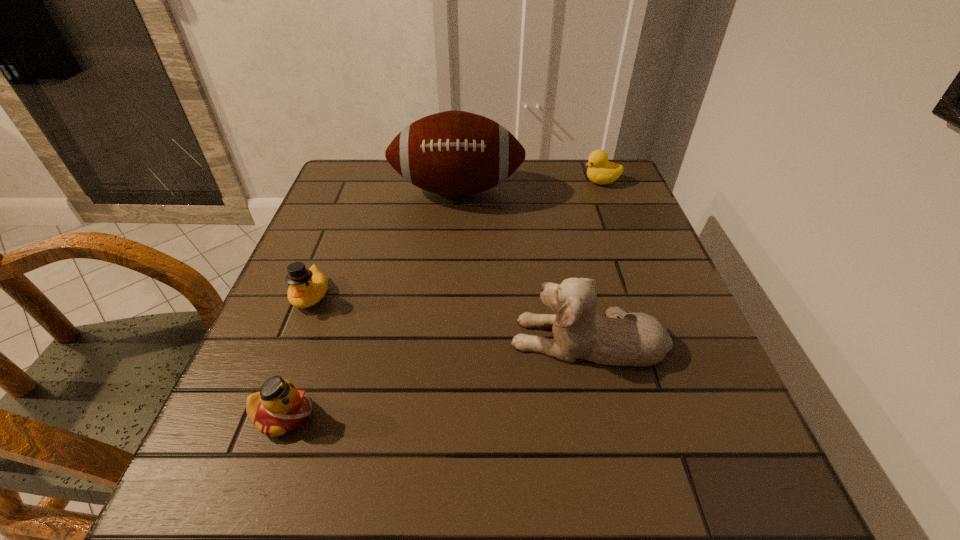
Image resolution: width=960 pixels, height=540 pixels. Find the location of `blank space located 0.390m on the front-facing side of the farthest duck`. blank space located 0.390m on the front-facing side of the farthest duck is located at coordinates (443, 181).

In order to click on free space located on the front-facing side of the farthest duck in this screenshot , I will do `click(496, 181)`.

The width and height of the screenshot is (960, 540). Identify the location of free space located on the front-facing side of the farthest duck. (478, 181).

The width and height of the screenshot is (960, 540). I want to click on free space located on the face of the nearest duck, so click(347, 415).

Image resolution: width=960 pixels, height=540 pixels. In order to click on football that is at the far edge in this screenshot , I will do `click(454, 153)`.

I want to click on duck that is at the far edge, so click(x=601, y=171).

This screenshot has width=960, height=540. In order to click on puppy that is at the right edge in this screenshot , I will do `click(620, 339)`.

Image resolution: width=960 pixels, height=540 pixels. In order to click on duck that is at the right edge in this screenshot , I will do `click(601, 171)`.

Where is `object that is at the far right corner`? object that is at the far right corner is located at coordinates (601, 171).

In the image, there is a desktop. Identify the location of vacant space at the far edge. The image size is (960, 540). (497, 200).